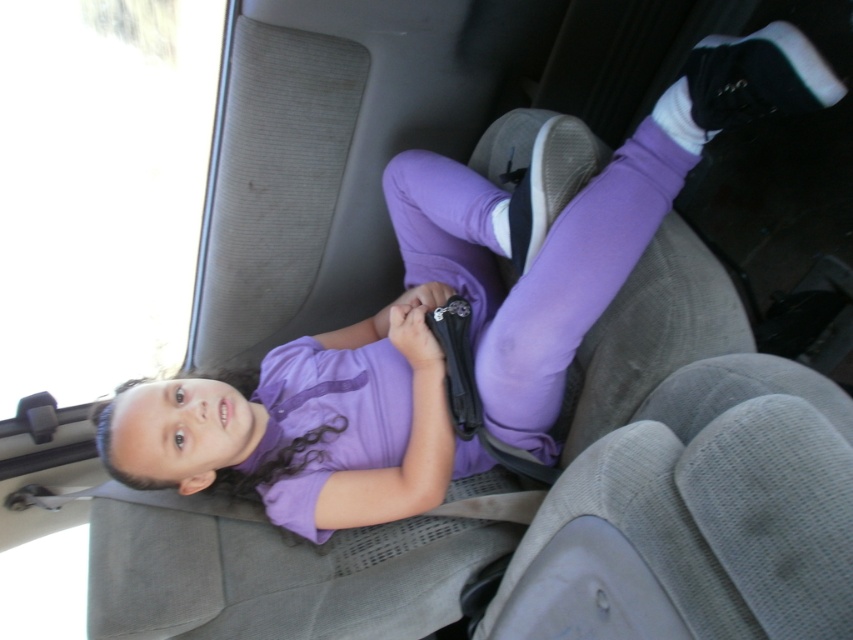
You are a fashion designer observing the car scene. You need to decide which item, the purple matte shirt at center or the black fabric strap at center, has a greater width. Based on the scene, can you determine this?

The purple matte shirt at center might be wider than black fabric strap at center, so it is possible that the purple matte shirt at center has a greater width.

You are a passenger in the car and want to check the color of the shirt the girl is wearing. Which object is higher up between the purple matte shirt at center and the black fabric strap at center?

The purple matte shirt at center is taller than the black fabric strap at center, so the purple matte shirt at center is higher up.

You are a passenger in the car and need to adjust your seatbelt. Which object is closer to the left side of the car? The purple matte shirt at center or the black fabric strap at center?

The purple matte shirt at center is to the left of the black fabric strap at center, so it is closer to the left side of the car.